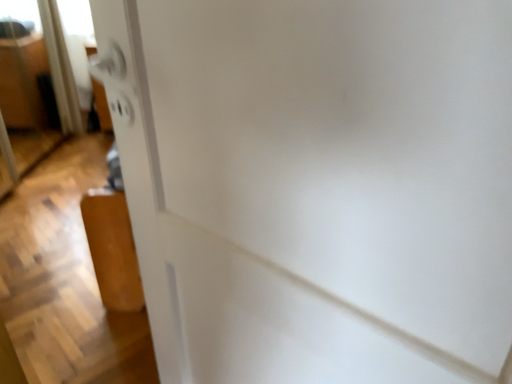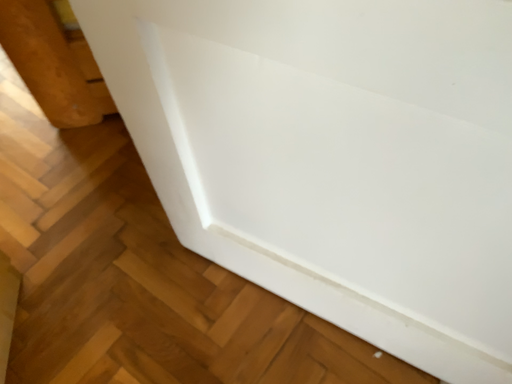
Question: How did the camera likely rotate when shooting the video?

Choices:
 (A) rotated upward
 (B) rotated downward

Answer: (B)